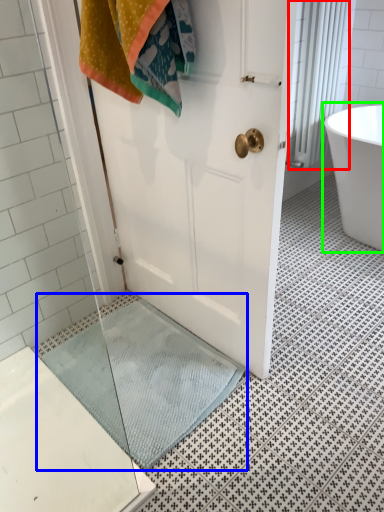
Question: Estimate the real-world distances between objects in this image. Which object is closer to shower curtain (highlighted by a red box), bath mat (highlighted by a blue box) or bathtub (highlighted by a green box)?

Choices:
 (A) bath mat
 (B) bathtub

Answer: (B)